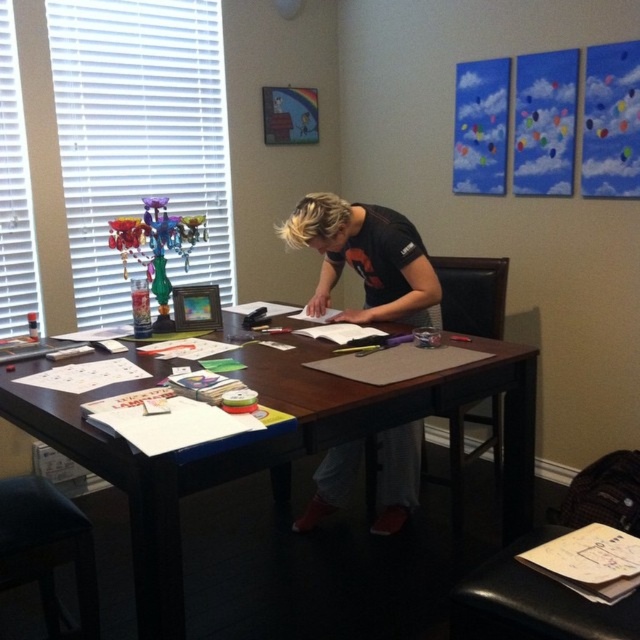
You are organizing a small event and need to place a 1.2 meter long banner on the desk. The banner must be placed between the black fabric shirt at center and the black leather stool at lower left. Considering their sizes, will the banner fit between them?

The black fabric shirt at center is bigger than the black leather stool at lower left, but the banner requires 1.2 meters of space. Since the description only provides size comparison between the two objects and not their actual distance, it is impossible to determine if the banner will fit between them.

You are standing in the workspace and want to reach both the point at (394, 388) and the point at (26, 518). Which point is closer to you?

Point (26, 518) is closer to you than point (394, 388) because the latter is further away from the camera.